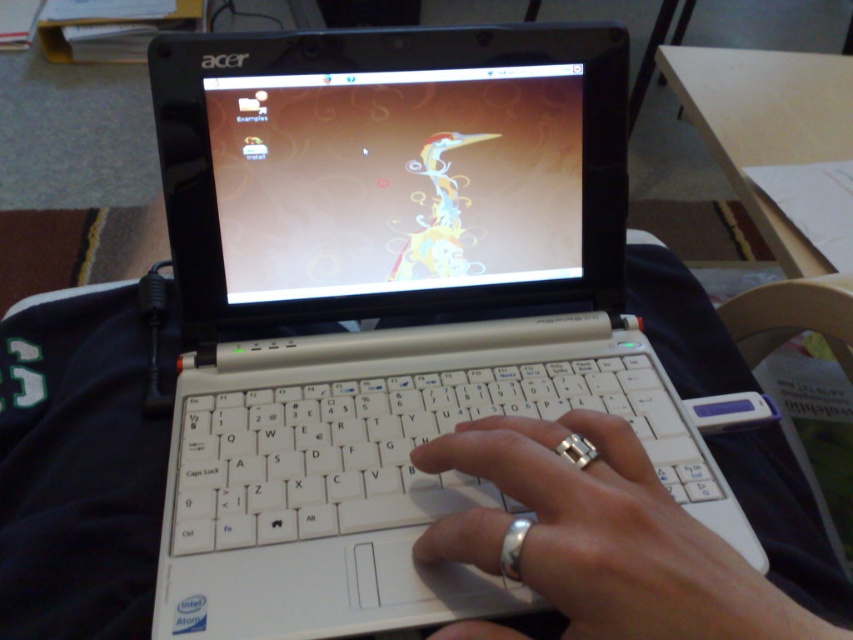
You are designing a new laptop case that needs to accommodate both the matte plastic screen at center and the white plastic keyboard at center. Based on their sizes, which part should the case prioritize in terms of space allocation?

The case should prioritize space allocation for the white plastic keyboard at center since it occupies more space than the matte plastic screen at center.

You are setting up a new laptop and need to identify components. Based on the image, which component is located above the other between the matte plastic screen at center and the white plastic keyboard at center?

The matte plastic screen at center is positioned over the white plastic keyboard at center.

You are a photographer taking a picture of the laptop screen. You notice two points on the screen at coordinates point [287,403] and point [587,477]. Which point will appear closer to the camera in the photo?

Point [287,403] is further to the camera than point [587,477], so it will appear closer to the camera in the photo.